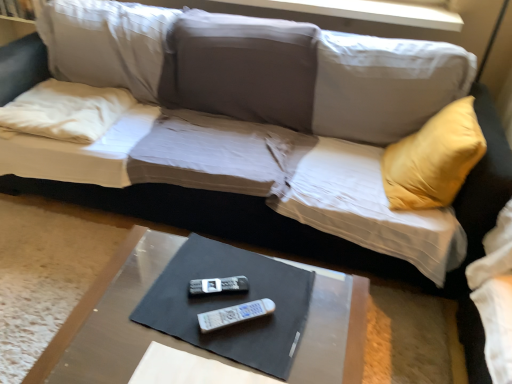
At what (x,y) coordinates should I click in order to perform the action: click on smooth brown table at lower center. Please return your answer as a coordinate pair (x, y). Image resolution: width=512 pixels, height=384 pixels. Looking at the image, I should click on click(x=113, y=319).

The image size is (512, 384). Identify the location of black plastic remote at center, which is the 2th remote in front-to-back order. (218, 285).

Find the location of a particular element. white fabric pillow at left is located at coordinates (65, 111).

Locate an element on the screen. The height and width of the screenshot is (384, 512). white plastic remote at center, positioned as the 2th remote in top-to-bottom order is located at coordinates pos(234,314).

Does point (215, 280) appear closer or farther from the camera than point (31, 106)?

Point (215, 280) is closer to the camera than point (31, 106).

Is black plastic remote at center, which is the 2th remote in front-to-back order, not close to white fabric pillow at left?

black plastic remote at center, which is the 2th remote in front-to-back order, is positioned a significant distance from white fabric pillow at left.

This screenshot has height=384, width=512. I want to click on pillow above the black plastic remote at center, the second remote when ordered from bottom to top (from a real-world perspective), so click(65, 111).

Between white fabric pillow at left and white plastic remote at center, the 1th remote in the front-to-back sequence, which one has smaller width?

Thinner between the two is white plastic remote at center, the 1th remote in the front-to-back sequence.

From a real-world perspective, is white fabric pillow at left above or below white plastic remote at center, marked as the 2th remote in a back-to-front arrangement?

In terms of real-world spatial position, white fabric pillow at left is above white plastic remote at center, marked as the 2th remote in a back-to-front arrangement.

Is white fabric pillow at left turned away from white plastic remote at center, the 1th remote in the front-to-back sequence?

No, white fabric pillow at left is not facing away from white plastic remote at center, the 1th remote in the front-to-back sequence.

Can you confirm if white fabric pillow at left is shorter than white plastic remote at center, the 1th remote in the front-to-back sequence?

Incorrect, the height of white fabric pillow at left does not fall short of that of white plastic remote at center, the 1th remote in the front-to-back sequence.

Which of these two, white plastic remote at center, the 1th remote in the front-to-back sequence, or black plastic remote at center, which is the 2th remote in front-to-back order, is bigger?

white plastic remote at center, the 1th remote in the front-to-back sequence, is bigger.

Is white plastic remote at center, marked as the 2th remote in a back-to-front arrangement, located outside black plastic remote at center, the second remote when ordered from bottom to top?

white plastic remote at center, marked as the 2th remote in a back-to-front arrangement, lies outside black plastic remote at center, the second remote when ordered from bottom to top,'s area.

Is the surface of white plastic remote at center, marked as the 2th remote in a back-to-front arrangement, in direct contact with black plastic remote at center, the second remote when ordered from bottom to top?

Yes, white plastic remote at center, marked as the 2th remote in a back-to-front arrangement, is beside black plastic remote at center, the second remote when ordered from bottom to top.

Can you confirm if white plastic remote at center, positioned as the 2th remote in top-to-bottom order, is taller than white fabric pillow at left?

In fact, white plastic remote at center, positioned as the 2th remote in top-to-bottom order, may be shorter than white fabric pillow at left.

How far apart are white plastic remote at center, the first remote ordered from the bottom, and white fabric pillow at left?

1.16 meters.

Find the location of a particular element. The image size is (512, 384). remote that is the 2nd one when counting forward from the white fabric pillow at left is located at coordinates (234, 314).

Is white plastic remote at center, the 1th remote in the front-to-back sequence, wider or thinner than white fabric pillow at left?

Clearly, white plastic remote at center, the 1th remote in the front-to-back sequence, has less width compared to white fabric pillow at left.

Is point (357, 320) closer or farther from the camera than point (52, 78)?

Point (357, 320) is positioned closer to the camera compared to point (52, 78).

From the image's perspective, which is above, smooth brown table at lower center or white fabric pillow at left?

white fabric pillow at left appears higher in the image.

Considering the sizes of smooth brown table at lower center and white fabric pillow at left in the image, is smooth brown table at lower center wider or thinner than white fabric pillow at left?

smooth brown table at lower center is wider than white fabric pillow at left.

At what (x,y) coordinates should I click in order to perform the action: click on pillow above the smooth brown table at lower center (from a real-world perspective). Please return your answer as a coordinate pair (x, y). Image resolution: width=512 pixels, height=384 pixels. Looking at the image, I should click on tap(65, 111).

Relative to smooth brown table at lower center, is white fabric pillow at left in front or behind?

Clearly, white fabric pillow at left is behind smooth brown table at lower center.

Is white fabric pillow at left wider than smooth brown table at lower center?

Incorrect, the width of white fabric pillow at left does not surpass that of smooth brown table at lower center.

Based on the photo, is the surface of white fabric pillow at left in direct contact with smooth brown table at lower center?

They are not placed beside each other.

In the scene shown: From a real-world perspective, is white fabric pillow at left physically located above or below smooth brown table at lower center?

white fabric pillow at left is situated higher than smooth brown table at lower center in the real world.

From the picture: Are smooth brown table at lower center and white plastic remote at center, marked as the 2th remote in a back-to-front arrangement, far apart?

smooth brown table at lower center is near white plastic remote at center, marked as the 2th remote in a back-to-front arrangement, not far away.

Is smooth brown table at lower center thinner than white plastic remote at center, marked as the 2th remote in a back-to-front arrangement?

In fact, smooth brown table at lower center might be wider than white plastic remote at center, marked as the 2th remote in a back-to-front arrangement.

From a real-world perspective, is smooth brown table at lower center located higher than white plastic remote at center, the 1th remote in the front-to-back sequence?

No, from a real-world perspective, smooth brown table at lower center is not above white plastic remote at center, the 1th remote in the front-to-back sequence.

Considering the points (305, 364) and (219, 318), which point is in front, point (305, 364) or point (219, 318)?

Positioned in front is point (305, 364).

In the image, there is a black plastic remote at center, the second remote when ordered from bottom to top. At what (x,y) coordinates should I click in order to perform the action: click on pillow above it (from the image's perspective). Please return your answer as a coordinate pair (x, y). The width and height of the screenshot is (512, 384). Looking at the image, I should click on (65, 111).

Identify the location of remote that is the 2nd object located below the white fabric pillow at left (from the image's perspective). The image size is (512, 384). (234, 314).

Looking at the image, which one is located closer to black plastic remote at center, arranged as the 1th remote when viewed from the back, white plastic remote at center, marked as the 2th remote in a back-to-front arrangement, or white fabric pillow at left?

white plastic remote at center, marked as the 2th remote in a back-to-front arrangement.

Which object lies further to the anchor point white plastic remote at center, marked as the 2th remote in a back-to-front arrangement, black plastic remote at center, the second remote when ordered from bottom to top, or smooth brown table at lower center?

smooth brown table at lower center is positioned further to the anchor white plastic remote at center, marked as the 2th remote in a back-to-front arrangement.

Looking at the image, which one is located further to white plastic remote at center, positioned as the 2th remote in top-to-bottom order, white fabric pillow at left or smooth brown table at lower center?

white fabric pillow at left lies further to white plastic remote at center, positioned as the 2th remote in top-to-bottom order, than the other object.

Which object lies further to the anchor point white fabric pillow at left, white plastic remote at center, positioned as the 2th remote in top-to-bottom order, or smooth brown table at lower center?

white plastic remote at center, positioned as the 2th remote in top-to-bottom order.

Estimate the real-world distances between objects in this image. Which object is closer to white plastic remote at center, positioned as the 2th remote in top-to-bottom order, smooth brown table at lower center or black plastic remote at center, arranged as the 1th remote when viewed from the back?

Among the two, black plastic remote at center, arranged as the 1th remote when viewed from the back, is located nearer to white plastic remote at center, positioned as the 2th remote in top-to-bottom order.

When comparing their distances from white fabric pillow at left, does white plastic remote at center, marked as the 2th remote in a back-to-front arrangement, or black plastic remote at center, arranged as the 1th remote when viewed from the back, seem closer?

black plastic remote at center, arranged as the 1th remote when viewed from the back, is positioned closer to the anchor white fabric pillow at left.

Estimate the real-world distances between objects in this image. Which object is closer to white fabric pillow at left, black plastic remote at center, the second remote when ordered from bottom to top, or smooth brown table at lower center?

The object closer to white fabric pillow at left is smooth brown table at lower center.

Which object lies further to the anchor point smooth brown table at lower center, white plastic remote at center, the first remote ordered from the bottom, or black plastic remote at center, the second remote when ordered from bottom to top?

black plastic remote at center, the second remote when ordered from bottom to top, is further to smooth brown table at lower center.

You are a GUI agent. You are given a task and a screenshot of the screen. Output one action in this format:
    pyautogui.click(x=<x>, y=<y>)
    Task: Click on the remote between white fabric pillow at left and white plastic remote at center, the first remote ordered from the bottom
    The width and height of the screenshot is (512, 384).
    Given the screenshot: What is the action you would take?
    pyautogui.click(x=218, y=285)

The width and height of the screenshot is (512, 384). Find the location of `remote between smooth brown table at lower center and black plastic remote at center, which is the 2th remote in front-to-back order, from front to back`. remote between smooth brown table at lower center and black plastic remote at center, which is the 2th remote in front-to-back order, from front to back is located at coordinates (234, 314).